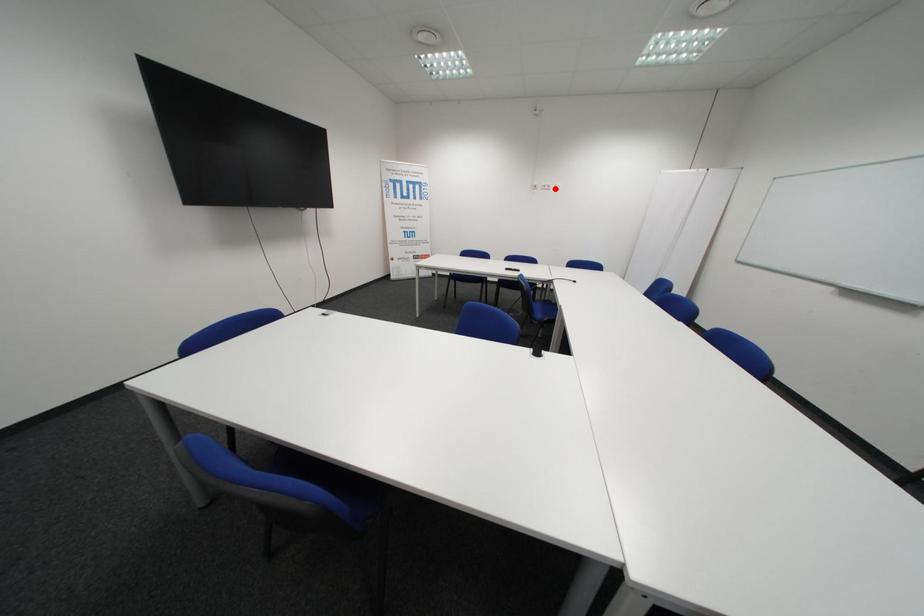
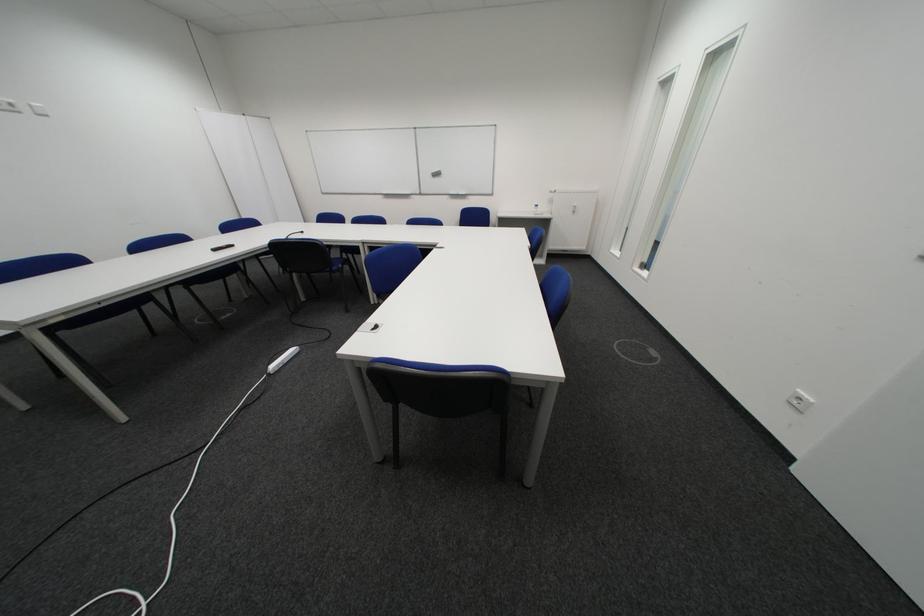
Question: I am providing you with two images of the same scene from different viewpoints. In image1, a red point is highlighted. Considering the same 3D point in image2, which of the following is correct?

Choices:
 (A) It is closer
 (B) It is farther

Answer: (B)